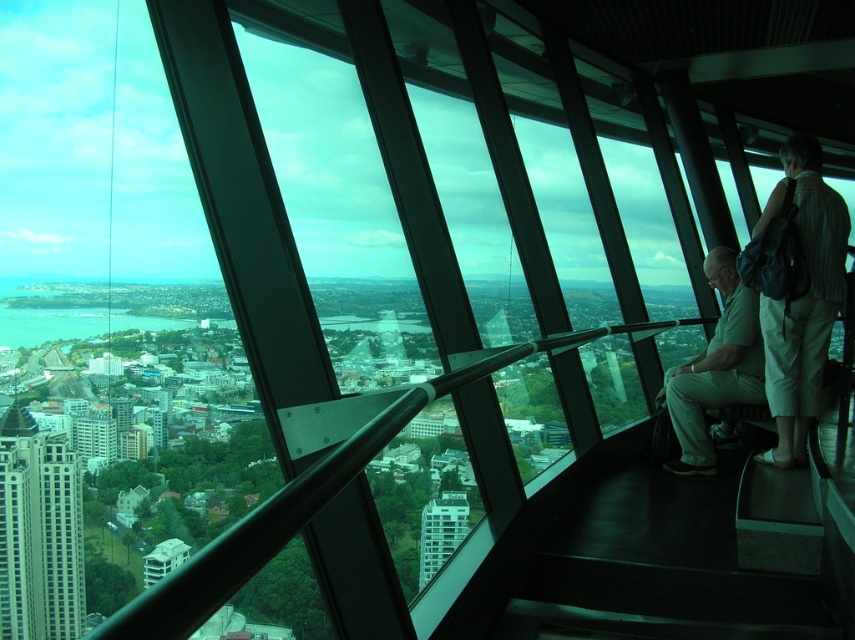
The width and height of the screenshot is (855, 640). What do you see at coordinates (802, 300) in the screenshot?
I see `striped fabric shirt at right` at bounding box center [802, 300].

Based on the photo, measure the distance from striped fabric shirt at right to white glass building at center.

striped fabric shirt at right and white glass building at center are 514.95 feet apart from each other.

This screenshot has height=640, width=855. What do you see at coordinates (802, 300) in the screenshot?
I see `striped fabric shirt at right` at bounding box center [802, 300].

Identify the location of striped fabric shirt at right. (802, 300).

Between point (34, 552) and point (460, 508), which one is positioned in front?

Positioned in front is point (34, 552).

Is white glossy building at left further to camera compared to white glass building at center?

That is False.

This screenshot has width=855, height=640. What do you see at coordinates (40, 538) in the screenshot? I see `white glossy building at left` at bounding box center [40, 538].

At what (x,y) coordinates should I click in order to perform the action: click on white glossy building at left. Please return your answer as a coordinate pair (x, y). This screenshot has width=855, height=640. Looking at the image, I should click on (40, 538).

Is white glossy building at left wider than striped fabric shirt at right?

No, white glossy building at left is not wider than striped fabric shirt at right.

You are a GUI agent. You are given a task and a screenshot of the screen. Output one action in this format:
    pyautogui.click(x=<x>, y=<y>)
    Task: Click on the white glossy building at left
    This screenshot has width=855, height=640.
    Given the screenshot: What is the action you would take?
    pyautogui.click(x=40, y=538)